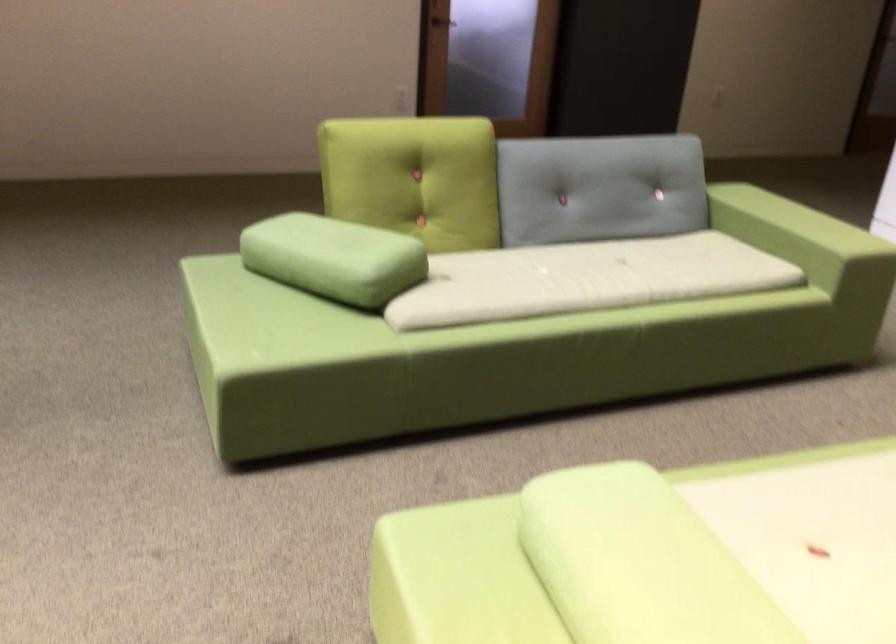
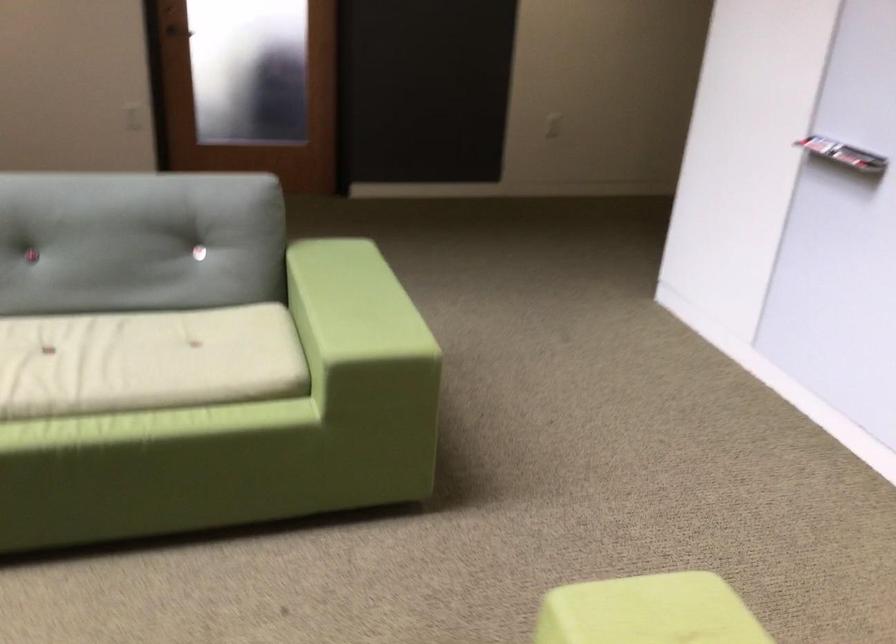
Which direction would the cameraman need to move to produce the second image?

The cameraman walked toward right, forward.